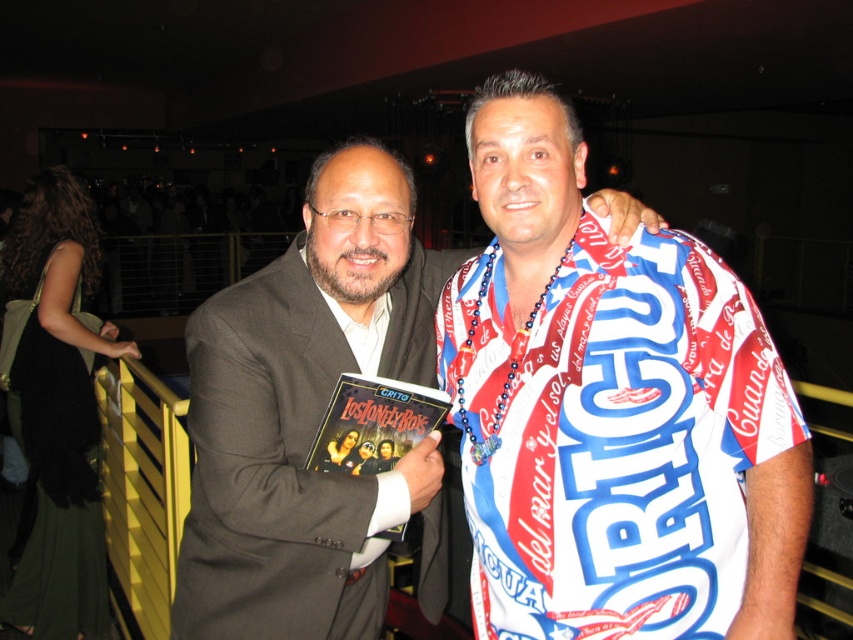
Question: Which point is closer to the camera?

Choices:
 (A) (352, 381)
 (B) (547, 625)

Answer: (B)

Question: Which object is farther from the camera taking this photo?

Choices:
 (A) printed fabric shirt at center
 (B) matte black suit at center
 (C) matte plastic book at center

Answer: (C)

Question: Can you confirm if matte black suit at center is wider than matte plastic book at center?

Choices:
 (A) yes
 (B) no

Answer: (A)

Question: Is printed fabric shirt at center wider than matte black suit at center?

Choices:
 (A) no
 (B) yes

Answer: (A)

Question: Estimate the real-world distances between objects in this image. Which object is farther from the matte plastic book at center?

Choices:
 (A) printed fabric shirt at center
 (B) matte black suit at center

Answer: (A)

Question: Does printed fabric shirt at center lie in front of matte plastic book at center?

Choices:
 (A) no
 (B) yes

Answer: (B)